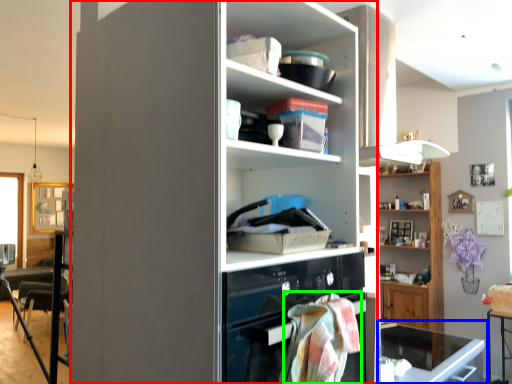
Question: Which object is positioned closest to cupboard (highlighted by a red box)? Select from desk (highlighted by a blue box) and blanket (highlighted by a green box).

Choices:
 (A) desk
 (B) blanket

Answer: (B)